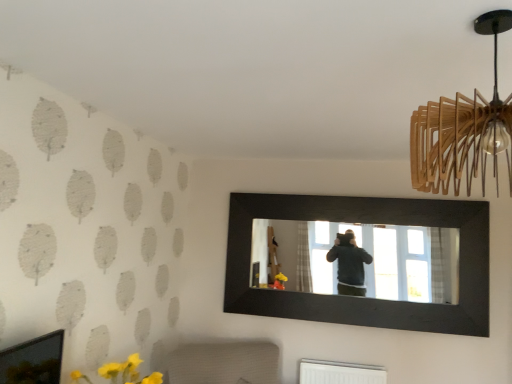
Describe the element at coordinates (463, 129) in the screenshot. I see `wooden pendant light at upper right` at that location.

Where is `black wooden mirror at center`? The width and height of the screenshot is (512, 384). black wooden mirror at center is located at coordinates (364, 298).

Considering the relative sizes of wooden pendant light at upper right and black wooden mirror at center in the image provided, is wooden pendant light at upper right thinner than black wooden mirror at center?

No, wooden pendant light at upper right is not thinner than black wooden mirror at center.

In the image, is wooden pendant light at upper right positioned in front of or behind black wooden mirror at center?

In the image, wooden pendant light at upper right appears in front of black wooden mirror at center.

Who is taller, wooden pendant light at upper right or black wooden mirror at center?

black wooden mirror at center is taller.

Is wooden pendant light at upper right to the left of black wooden mirror at center from the viewer's perspective?

Indeed, wooden pendant light at upper right is positioned on the left side of black wooden mirror at center.

Is black wooden mirror at center in contact with white textured radiator at lower center?

No, black wooden mirror at center is not next to white textured radiator at lower center.

Measure the distance between black wooden mirror at center and white textured radiator at lower center.

A distance of 28.63 inches exists between black wooden mirror at center and white textured radiator at lower center.

From the image's perspective, would you say black wooden mirror at center is shown under white textured radiator at lower center?

Incorrect, from the image's perspective, black wooden mirror at center is higher than white textured radiator at lower center.

Could white textured radiator at lower center be considered to be inside black wooden mirror at center?

No, white textured radiator at lower center is not surrounded by black wooden mirror at center.

Is white textured radiator at lower center further to camera compared to black wooden mirror at center?

No, it is in front of black wooden mirror at center.

Is white textured radiator at lower center situated inside black wooden mirror at center or outside?

white textured radiator at lower center is not inside black wooden mirror at center, it's outside.

Is white textured radiator at lower center taller or shorter than black wooden mirror at center?

white textured radiator at lower center is shorter than black wooden mirror at center.

Can you confirm if white textured radiator at lower center is smaller than black wooden mirror at center?

No, white textured radiator at lower center is not smaller than black wooden mirror at center.

Looking at their sizes, would you say black wooden mirror at center is wider or thinner than wooden pendant light at upper right?

Clearly, black wooden mirror at center has less width compared to wooden pendant light at upper right.

Is black wooden mirror at center in front of wooden pendant light at upper right?

No, it is behind wooden pendant light at upper right.

From the picture: Is wooden pendant light at upper right completely or partially inside black wooden mirror at center?

No, wooden pendant light at upper right is located outside of black wooden mirror at center.

From the image's perspective, does black wooden mirror at center appear higher than wooden pendant light at upper right?

No.

Which is closer, (186, 362) or (422, 124)?

The point (422, 124) is in front.

This screenshot has height=384, width=512. In order to click on furniture to the left of wooden pendant light at upper right in this screenshot , I will do `click(224, 363)`.

Which is more to the right, white textured radiator at lower center or wooden pendant light at upper right?

From the viewer's perspective, wooden pendant light at upper right appears more on the right side.

Is white textured radiator at lower center behind wooden pendant light at upper right?

Yes, white textured radiator at lower center is further from the viewer.

Does point (433, 152) appear closer or farther from the camera than point (264, 380)?

Point (433, 152) is closer to the camera than point (264, 380).

Is wooden pendant light at upper right facing towards white textured radiator at lower center?

No, wooden pendant light at upper right is not oriented towards white textured radiator at lower center.

Considering the relative sizes of wooden pendant light at upper right and white textured radiator at lower center in the image provided, is wooden pendant light at upper right smaller than white textured radiator at lower center?

Yes.

Can you tell me how much wooden pendant light at upper right and white textured radiator at lower center differ in facing direction?

149 degrees separate the facing orientations of wooden pendant light at upper right and white textured radiator at lower center.

Where is `picture frame lying behind the wooden pendant light at upper right`? The image size is (512, 384). picture frame lying behind the wooden pendant light at upper right is located at coordinates (364, 298).

The image size is (512, 384). Find the location of `picture frame on the right of white textured radiator at lower center`. picture frame on the right of white textured radiator at lower center is located at coordinates (364, 298).

Which object lies further to the anchor point wooden pendant light at upper right, black wooden mirror at center or white textured radiator at lower center?

white textured radiator at lower center.

Considering their positions, is white textured radiator at lower center positioned further to black wooden mirror at center than wooden pendant light at upper right?

wooden pendant light at upper right is positioned further to the anchor black wooden mirror at center.

Which object lies nearer to the anchor point wooden pendant light at upper right, white textured radiator at lower center or black wooden mirror at center?

black wooden mirror at center.

From the image, which object appears to be nearer to white textured radiator at lower center, wooden pendant light at upper right or black wooden mirror at center?

Among the two, black wooden mirror at center is located nearer to white textured radiator at lower center.

Considering their positions, is black wooden mirror at center positioned further to white textured radiator at lower center than wooden pendant light at upper right?

wooden pendant light at upper right is further to white textured radiator at lower center.

Which object lies nearer to the anchor point black wooden mirror at center, wooden pendant light at upper right or white textured radiator at lower center?

white textured radiator at lower center.

In order to click on furniture between wooden pendant light at upper right and black wooden mirror at center along the z-axis in this screenshot , I will do `click(224, 363)`.